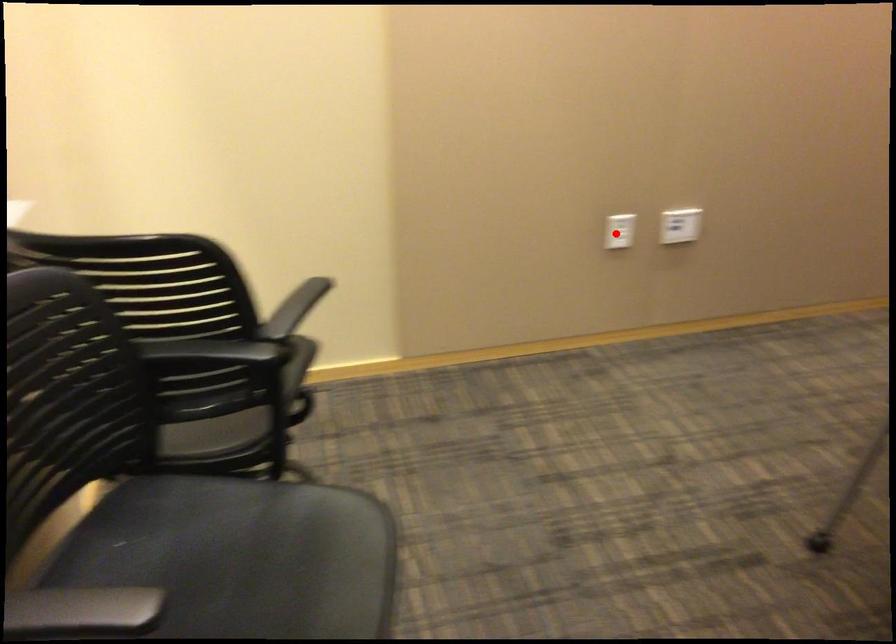
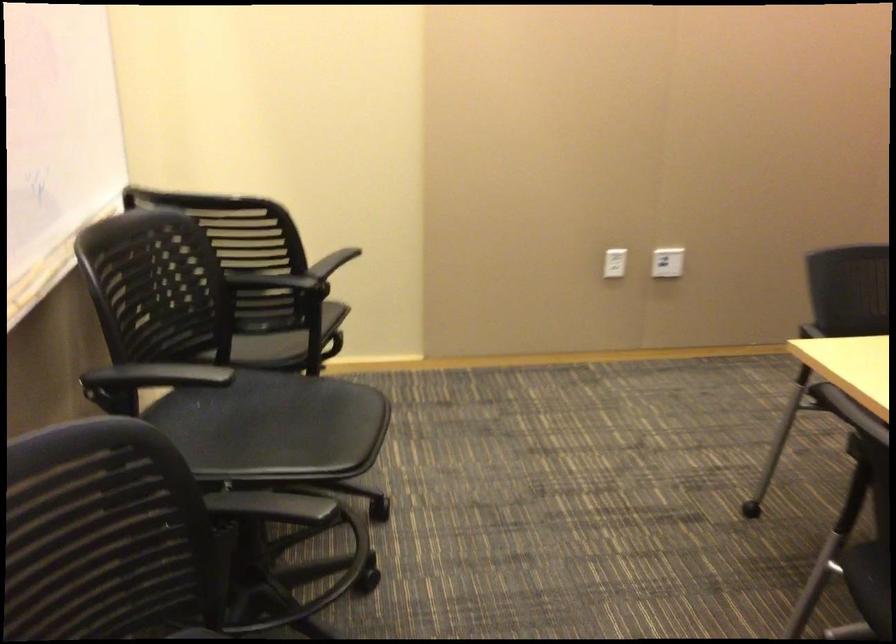
Where in the second image is the point corresponding to the highlighted location from the first image?

(615, 263)